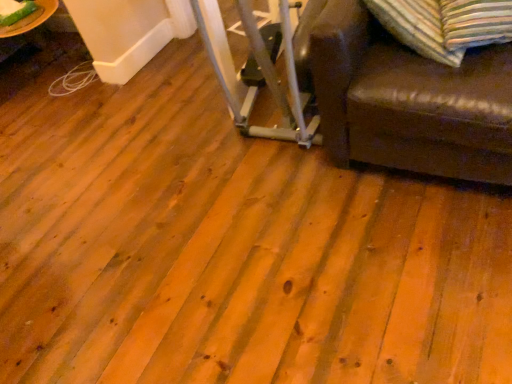
Question: From the image's perspective, would you say striped fabric pillow at upper right is positioned over green glass plate at upper left?

Choices:
 (A) no
 (B) yes

Answer: (A)

Question: Are striped fabric pillow at upper right and green glass plate at upper left beside each other?

Choices:
 (A) yes
 (B) no

Answer: (B)

Question: From a real-world perspective, is striped fabric pillow at upper right over green glass plate at upper left?

Choices:
 (A) yes
 (B) no

Answer: (A)

Question: Is striped fabric pillow at upper right smaller than green glass plate at upper left?

Choices:
 (A) yes
 (B) no

Answer: (B)

Question: Does striped fabric pillow at upper right have a lesser height compared to green glass plate at upper left?

Choices:
 (A) no
 (B) yes

Answer: (A)

Question: Is striped fabric pillow at upper right to the right of green glass plate at upper left from the viewer's perspective?

Choices:
 (A) yes
 (B) no

Answer: (A)

Question: From a real-world perspective, does green glass plate at upper left stand above striped fabric pillow at upper right?

Choices:
 (A) yes
 (B) no

Answer: (B)

Question: Would you say green glass plate at upper left is a long distance from striped fabric pillow at upper right?

Choices:
 (A) no
 (B) yes

Answer: (B)

Question: Can you see green glass plate at upper left touching striped fabric pillow at upper right?

Choices:
 (A) yes
 (B) no

Answer: (B)

Question: Could striped fabric pillow at upper right be considered to be inside green glass plate at upper left?

Choices:
 (A) yes
 (B) no

Answer: (B)

Question: Is green glass plate at upper left turned away from striped fabric pillow at upper right?

Choices:
 (A) yes
 (B) no

Answer: (B)

Question: Is green glass plate at upper left bigger than striped fabric pillow at upper right?

Choices:
 (A) no
 (B) yes

Answer: (A)

Question: Relative to green glass plate at upper left, is striped fabric pillow at upper right in front or behind?

Choices:
 (A) behind
 (B) front

Answer: (B)